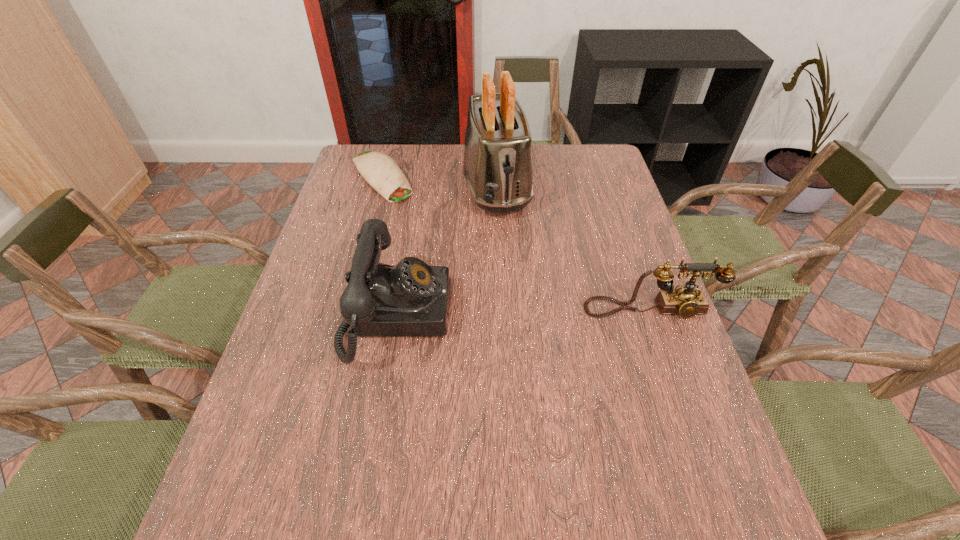
I want to click on vacant point located between the burrito and the toaster, so click(439, 181).

In order to click on free area in between the second object from right to left and the shorter telephone in this screenshot , I will do `click(573, 248)`.

Locate an element on the screen. free area in between the burrito and the tallest object is located at coordinates (439, 181).

This screenshot has width=960, height=540. In order to click on the second closest object to the burrito in this screenshot , I will do `click(411, 299)`.

You are a GUI agent. You are given a task and a screenshot of the screen. Output one action in this format:
    pyautogui.click(x=<x>, y=<y>)
    Task: Click on the object that is the second closest one to the toaster
    Image resolution: width=960 pixels, height=540 pixels.
    Given the screenshot: What is the action you would take?
    pyautogui.click(x=411, y=299)

Locate an element on the screen. The image size is (960, 540). vacant space that satisfies the following two spatial constraints: 1. on the front side of the left telephone; 2. on the dial of the shortest object is located at coordinates (343, 315).